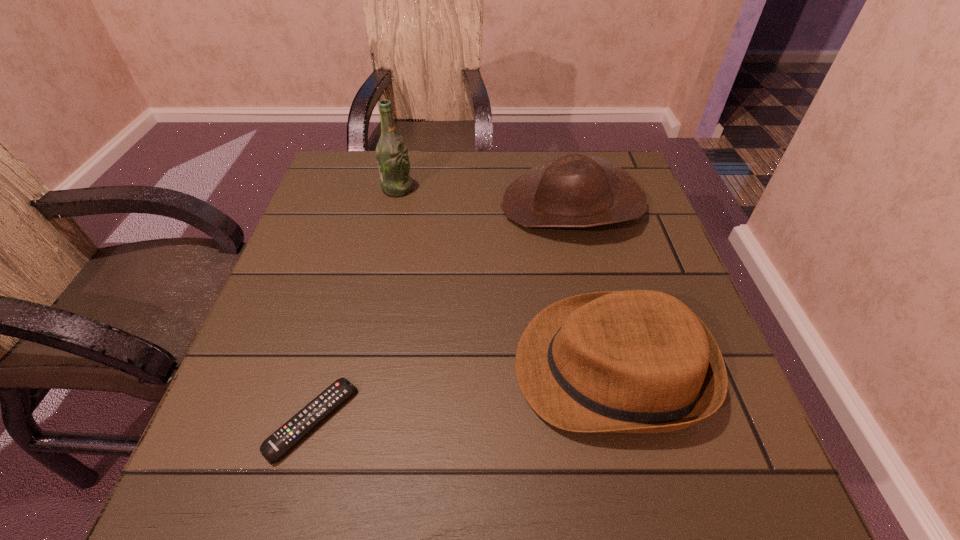
Where is `vacant space that's between the tallest object and the remote control`? Image resolution: width=960 pixels, height=540 pixels. vacant space that's between the tallest object and the remote control is located at coordinates (355, 305).

At what (x,y) coordinates should I click in order to perform the action: click on unoccupied area between the remote control and the fedora. Please return your answer as a coordinate pair (x, y). The height and width of the screenshot is (540, 960). Looking at the image, I should click on (462, 394).

This screenshot has width=960, height=540. Find the location of `unoccupied position between the shortest object and the fedora`. unoccupied position between the shortest object and the fedora is located at coordinates (462, 394).

Image resolution: width=960 pixels, height=540 pixels. Identify the location of free space between the remote control and the cowboy hat. (443, 313).

Where is `vacant area that lies between the remote control and the fedora`? vacant area that lies between the remote control and the fedora is located at coordinates (462, 394).

Locate an element on the screen. Image resolution: width=960 pixels, height=540 pixels. free point between the tallest object and the cowboy hat is located at coordinates (485, 197).

Identify which object is located as the second nearest to the cowboy hat. Please provide its 2D coordinates. Your answer should be formatted as a tuple, i.e. [(x, y)], where the tuple contains the x and y coordinates of a point satisfying the conditions above.

[(392, 157)]

Point out which object is positioned as the third nearest to the cowboy hat. Please provide its 2D coordinates. Your answer should be formatted as a tuple, i.e. [(x, y)], where the tuple contains the x and y coordinates of a point satisfying the conditions above.

[(277, 444)]

The width and height of the screenshot is (960, 540). I want to click on vacant space that satisfies the following two spatial constraints: 1. on the surface of the beer bottle; 2. on the left side of the cowboy hat, so click(394, 206).

This screenshot has height=540, width=960. I want to click on blank space that satisfies the following two spatial constraints: 1. on the surface of the tallest object; 2. on the front side of the remote control, so click(x=347, y=420).